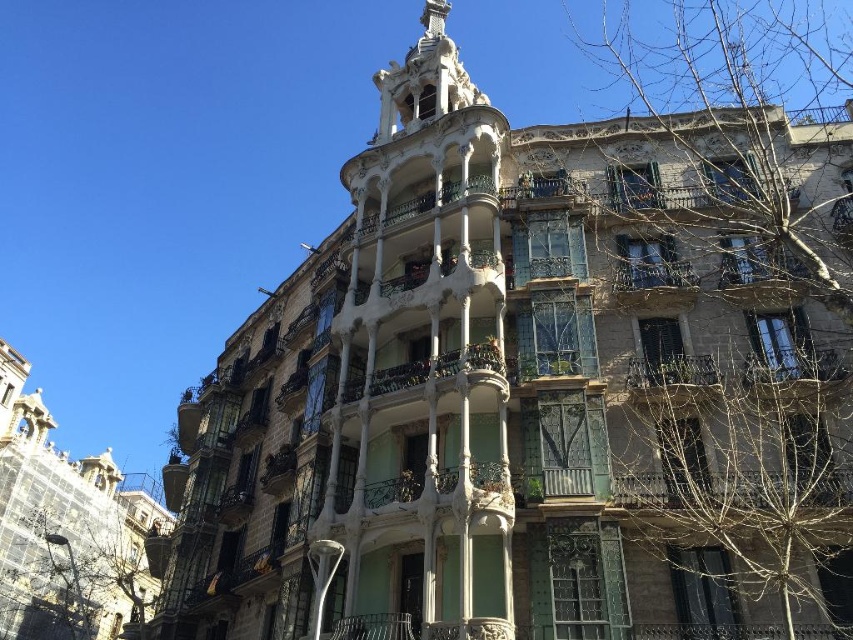
You are standing in front of the building and notice a point marked at coordinates (757, 273). Based on the scene description, which object does this point most likely correspond to?

The point at coordinates (757, 273) corresponds to the green wrought iron balcony at upper center.

You are an architect evaluating the building structure. You need to determine which balcony, the green wrought iron balcony at upper center or the rustic wrought iron balcony at center, requires more vertical space for installation. Based on the image, which one would you choose?

The green wrought iron balcony at upper center requires more vertical space because it is much taller than the rustic wrought iron balcony at center.